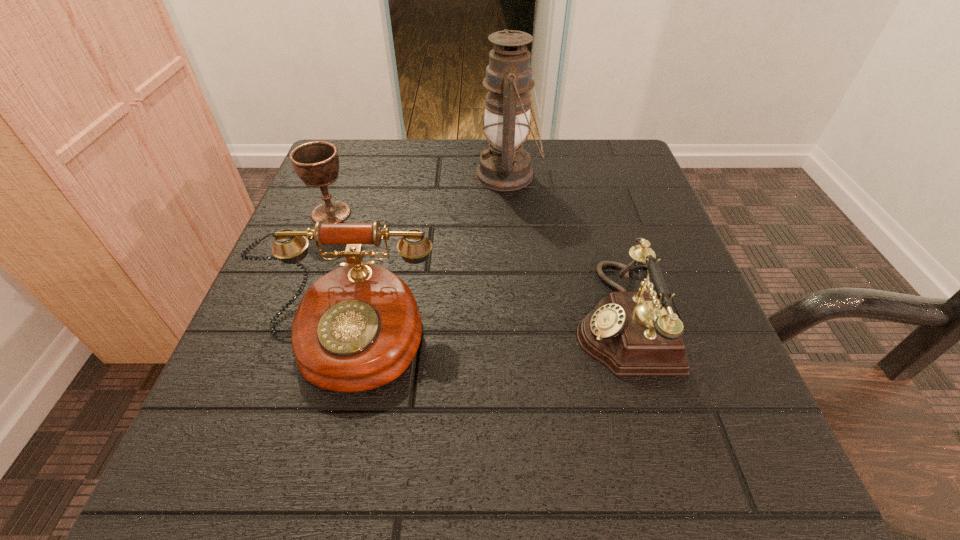
Select which object appears as the second closest to the third shortest object. Please provide its 2D coordinates. Your answer should be formatted as a tuple, i.e. [(x, y)], where the tuple contains the x and y coordinates of a point satisfying the conditions above.

[(631, 333)]

Where is `free spot that satisfies the following two spatial constraints: 1. on the dial of the shorter telephone; 2. on the dial of the taller telephone`? Image resolution: width=960 pixels, height=540 pixels. free spot that satisfies the following two spatial constraints: 1. on the dial of the shorter telephone; 2. on the dial of the taller telephone is located at coordinates (626, 338).

You are a GUI agent. You are given a task and a screenshot of the screen. Output one action in this format:
    pyautogui.click(x=<x>, y=<y>)
    Task: Click on the free location that satisfies the following two spatial constraints: 1. on the back side of the second object from right to left; 2. on the right side of the chalice
    This screenshot has height=540, width=960.
    Given the screenshot: What is the action you would take?
    coord(346,175)